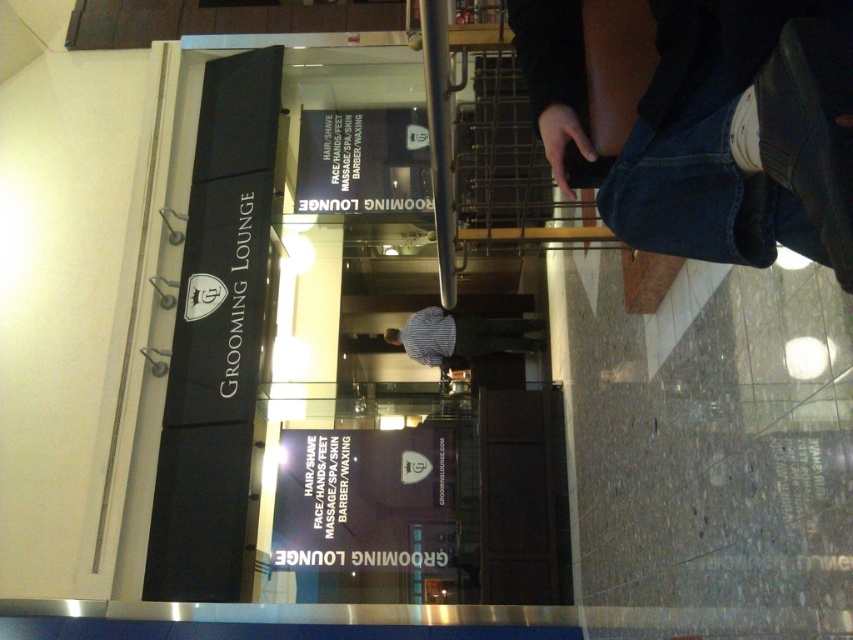
You are standing outside the Grooming Lounge store entrance and see two points marked on the glass facade. The first point is at coordinate point (642, 40) and the second is at point (492, 323). If you want to touch the point that is closer to you, which coordinate should you choose?

Point (642, 40) is in front of point (492, 323), so you should choose point (642, 40) as it is closer to you.

You are a customer entering the Grooming Lounge and see the denim pants at lower right and the striped shirt at center. Which item is covering the other one?

The denim pants at lower right is positioned over striped shirt at center, meaning the denim pants are covering the striped shirt at center.